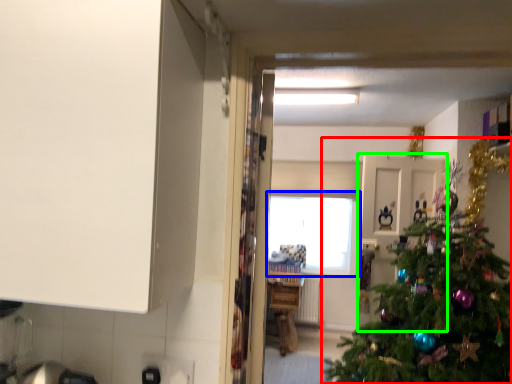
Question: Which object is the farthest from christmas tree (highlighted by a red box)? Choose among these: window (highlighted by a blue box) or door (highlighted by a green box).

Choices:
 (A) window
 (B) door

Answer: (A)